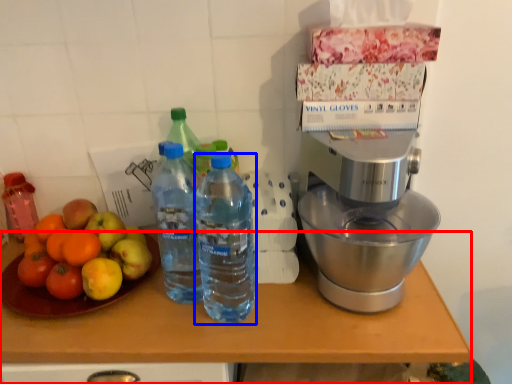
Question: Which point is further to the camera, table (highlighted by a red box) or bottle (highlighted by a blue box)?

Choices:
 (A) table
 (B) bottle

Answer: (A)